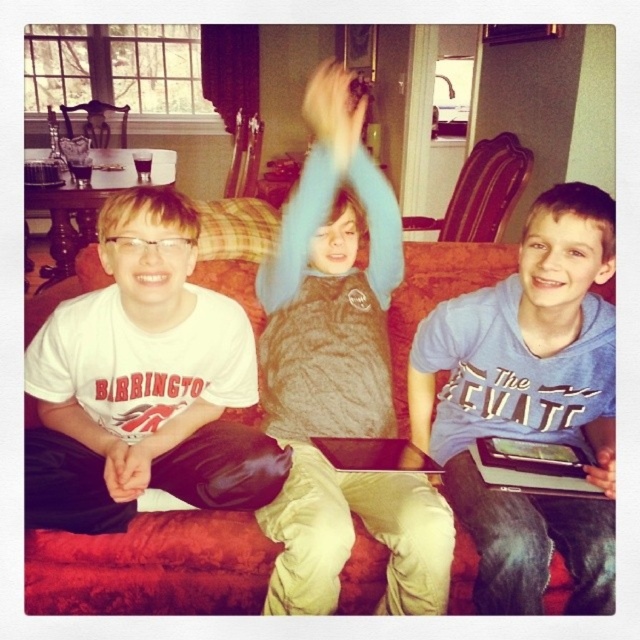
From the picture: You are a photographer setting up a photo shoot in this living room. You need to ensure that the white cotton shirt at left and the red fabric couch at center are both visible in the frame. Given their sizes, which object will appear larger in the final photograph?

The white cotton shirt at left appears larger in the final photograph because it has a greater height compared to the red fabric couch at center according to the description.

You are a photographer trying to capture a closeup of the boy on the right. You have two markers placed at point (292, 570) and point (51, 563). Which marker should you use to frame the boy on the right for a closer shot?

Point (292, 570) is closer to the camera than point (51, 563), so you should use the marker at point (292, 570) to frame the boy on the right for a closer shot.

You are a photographer setting up a photo shoot in the living room. You have a fluffy brown vest at center and a red fabric couch at center in the scene. Which object is taller?

The fluffy brown vest at center is much taller than the red fabric couch at center.